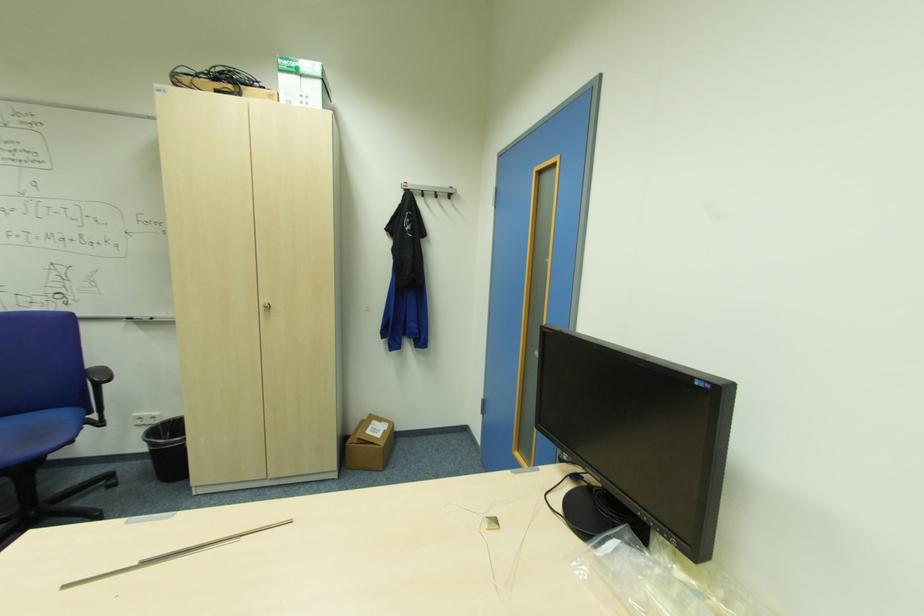
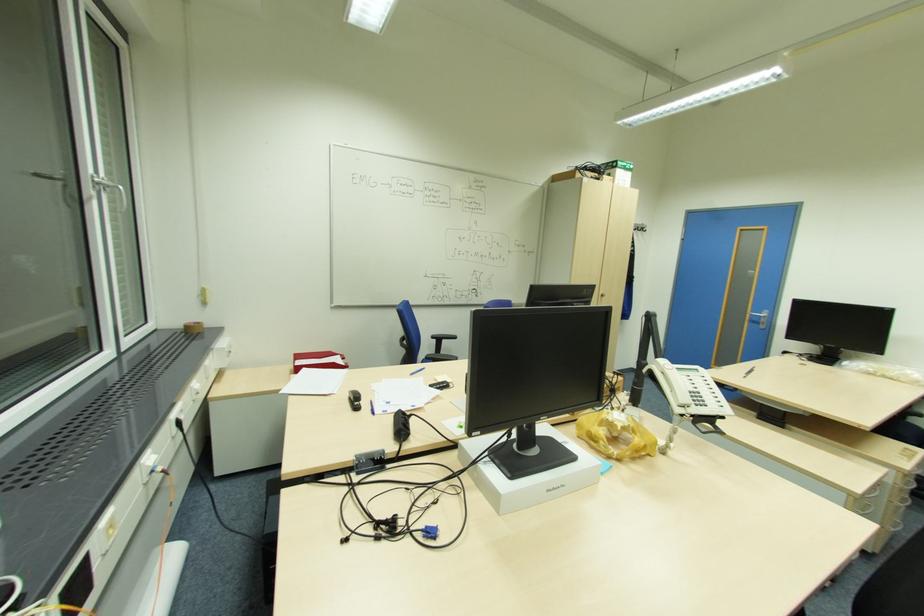
Question: What movement of the cameraman would produce the second image?

Choices:
 (A) Left
 (B) Right
 (C) Forward
 (D) Backward

Answer: (A)